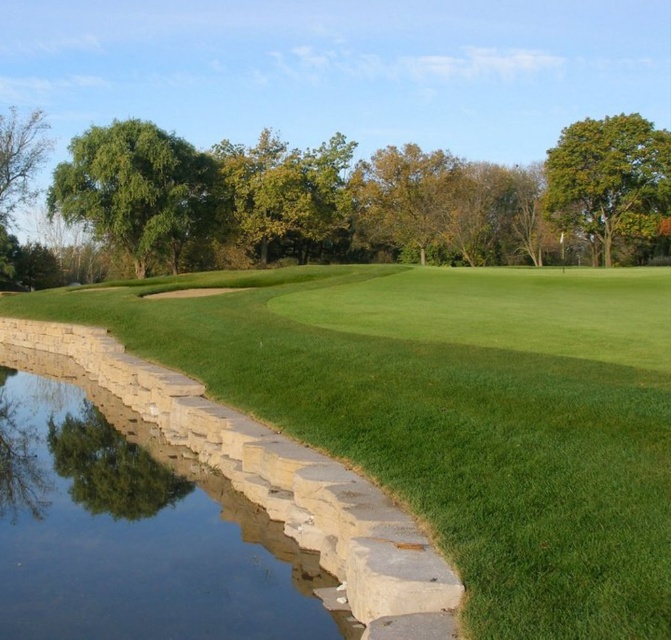
You are standing on the golf course and want to place a small flag exactly at the center of the green grass at center. According to the coordinates provided, where should you place the flag?

The green grass at center is located at point [456,413], so you should place the flag at those coordinates to mark its center.

You are a golfer standing on the green leafy tree at left. You want to hit a ball to the clear water at bottom left. Which direction should you aim?

The green leafy tree at left is located above clear water at bottom left, so you should aim downward towards the clear water at bottom left.

You are a golfer standing on the green leafy tree at left and the clear water at bottom left. Which object is located to the right of the other?

The green leafy tree at left is positioned on the left side of clear water at bottom left, so the clear water at bottom left is to the right of the green leafy tree at left.